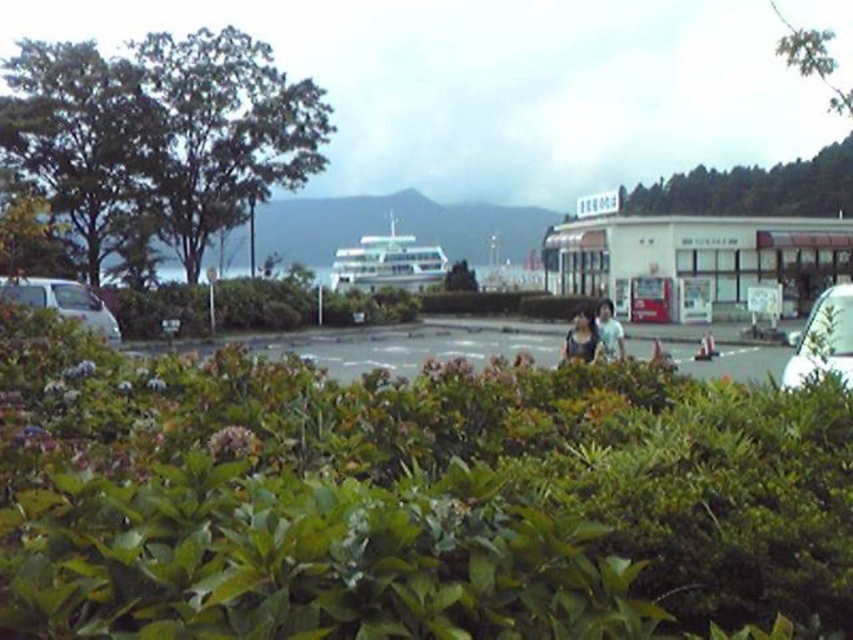
Who is positioned more to the left, green leafy bush at center or white glossy car at right?

Positioned to the left is green leafy bush at center.

This screenshot has height=640, width=853. In order to click on green leafy bush at center in this screenshot , I will do `click(408, 499)`.

Is white glossy car at right above white matte van at left?

No.

Measure the distance between point (837, 326) and camera.

8.65 meters

The height and width of the screenshot is (640, 853). Identify the location of white glossy car at right. (824, 339).

Which is below, green leafy bush at center or white matte van at left?

green leafy bush at center is lower down.

I want to click on green leafy bush at center, so click(408, 499).

The width and height of the screenshot is (853, 640). Find the location of `green leafy bush at center`. green leafy bush at center is located at coordinates (408, 499).